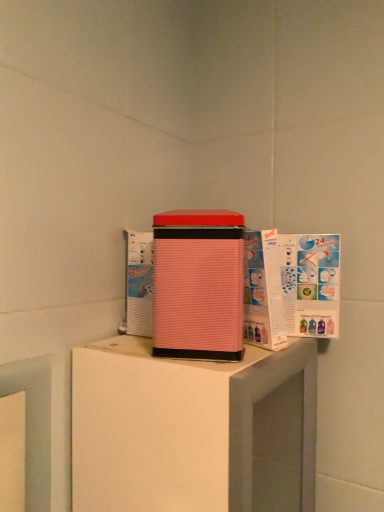
The height and width of the screenshot is (512, 384). Describe the element at coordinates (198, 284) in the screenshot. I see `pink textured box at center` at that location.

Where is `pink textured box at center`? Image resolution: width=384 pixels, height=512 pixels. pink textured box at center is located at coordinates (198, 284).

Locate an element on the screen. Image resolution: width=384 pixels, height=512 pixels. pink textured box at center is located at coordinates coord(198,284).